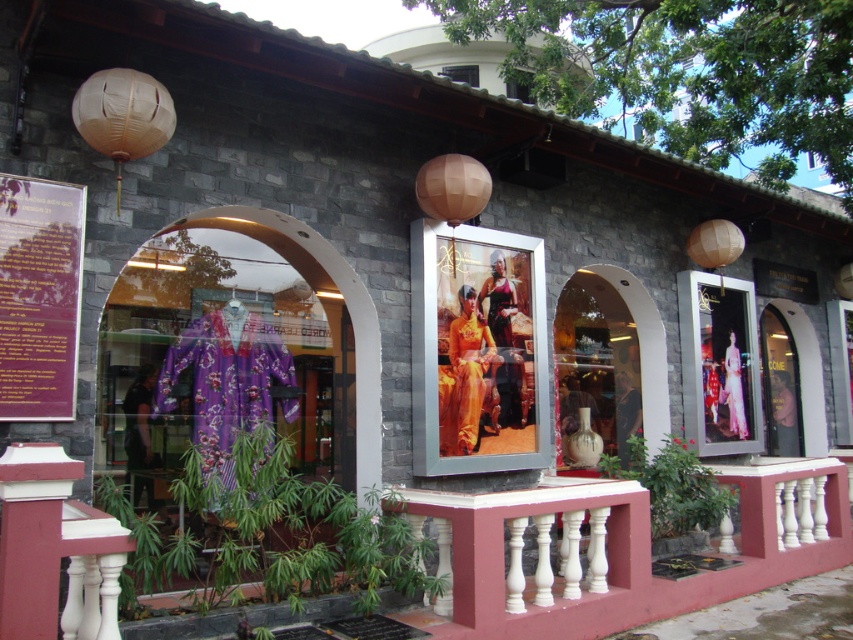
Question: Which point appears closest to the camera in this image?

Choices:
 (A) (523, 88)
 (B) (219, 230)

Answer: (B)

Question: Is white painted wood balustrade at center wider than transparent glass window at center?

Choices:
 (A) yes
 (B) no

Answer: (A)

Question: Can you confirm if purple paper at left is positioned above transparent glass window at center?

Choices:
 (A) no
 (B) yes

Answer: (A)

Question: Considering the real-world distances, which object is farthest from the transparent glass window at center?

Choices:
 (A) purple paper at left
 (B) purple floral robe at center

Answer: (A)

Question: Is metallic silver frame at center to the left of purple paper at left from the viewer's perspective?

Choices:
 (A) yes
 (B) no

Answer: (B)

Question: Which point is farther to the camera?

Choices:
 (A) (508, 74)
 (B) (751, 385)

Answer: (A)